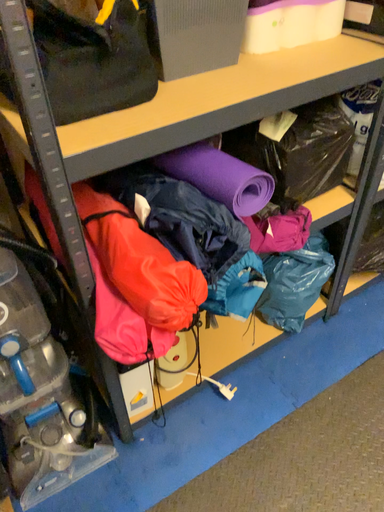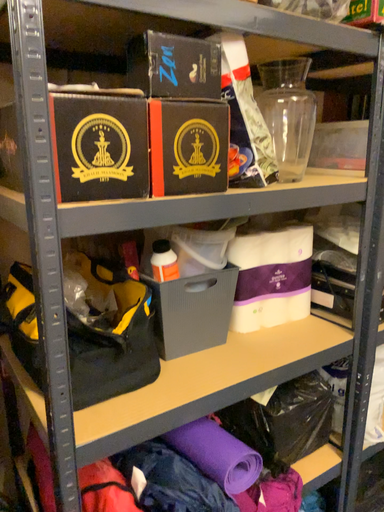
Question: How did the camera likely rotate when shooting the video?

Choices:
 (A) rotated upward
 (B) rotated downward

Answer: (A)